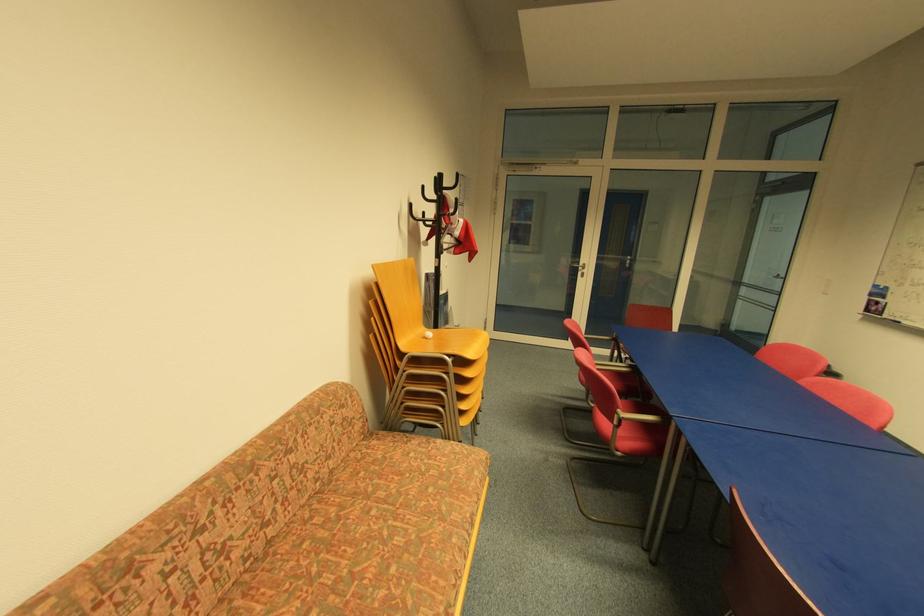
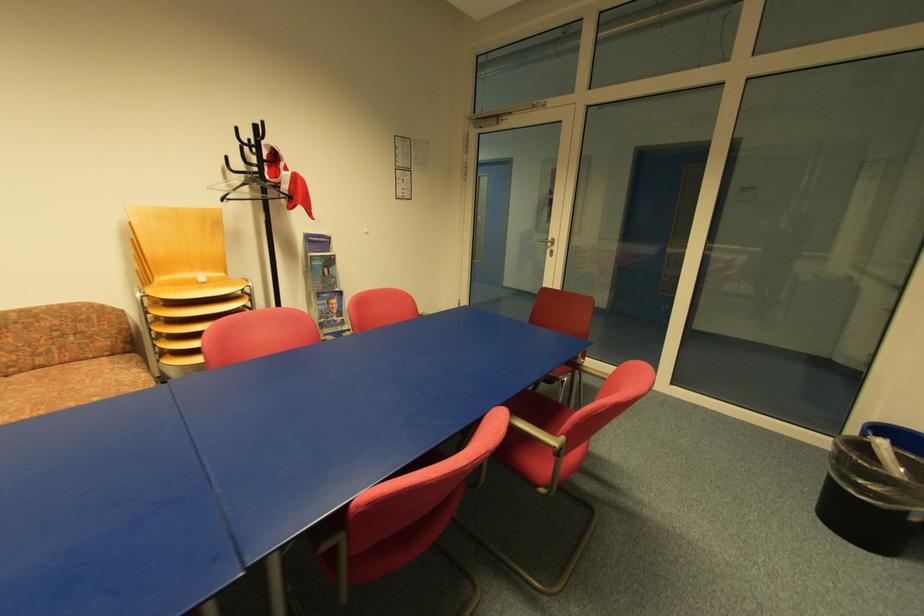
What movement of the cameraman would produce the second image?

The cameraman walked toward right, forward.